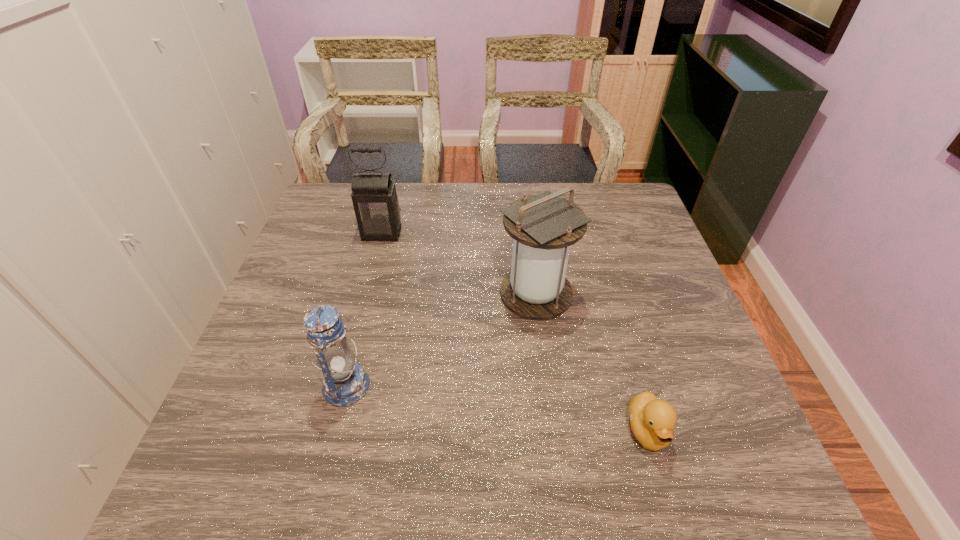
Choose which lantern is the second nearest neighbor to the nearest lantern. Please provide its 2D coordinates. Your answer should be formatted as a tuple, i.e. [(x, y)], where the tuple contains the x and y coordinates of a point satisfying the conditions above.

[(375, 201)]

Image resolution: width=960 pixels, height=540 pixels. Identify the location of free location that satisfies the following two spatial constraints: 1. on the front-facing side of the third nearest object; 2. on the left side of the farthest object. (367, 293).

The image size is (960, 540). I want to click on free space in the image that satisfies the following two spatial constraints: 1. on the front-facing side of the farthest lantern; 2. on the right side of the rightmost lantern, so click(367, 293).